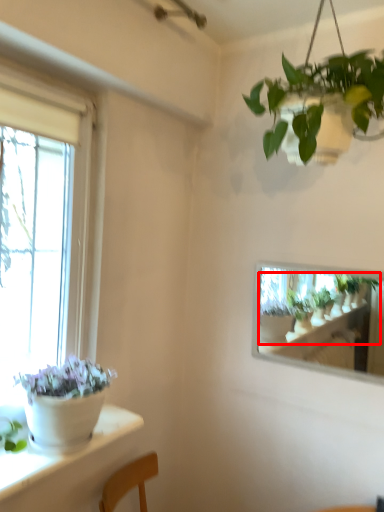
Question: From the image, what is the correct spatial relationship of houseplant (annotated by the red box) in relation to houseplant?

Choices:
 (A) left
 (B) right

Answer: (B)